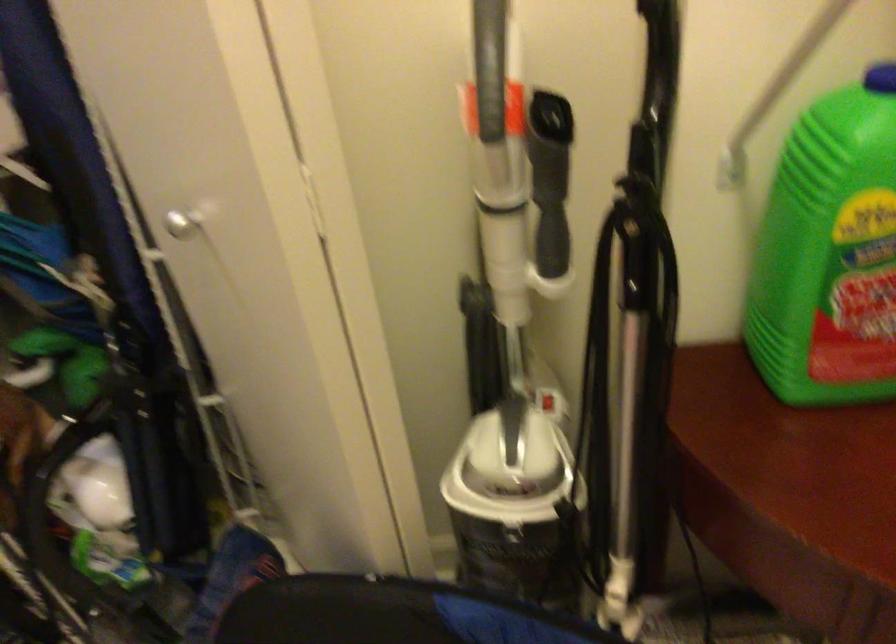
Find where to push the red vacuum switch. Please return your answer as a coordinate pair (x, y).

(501, 98)